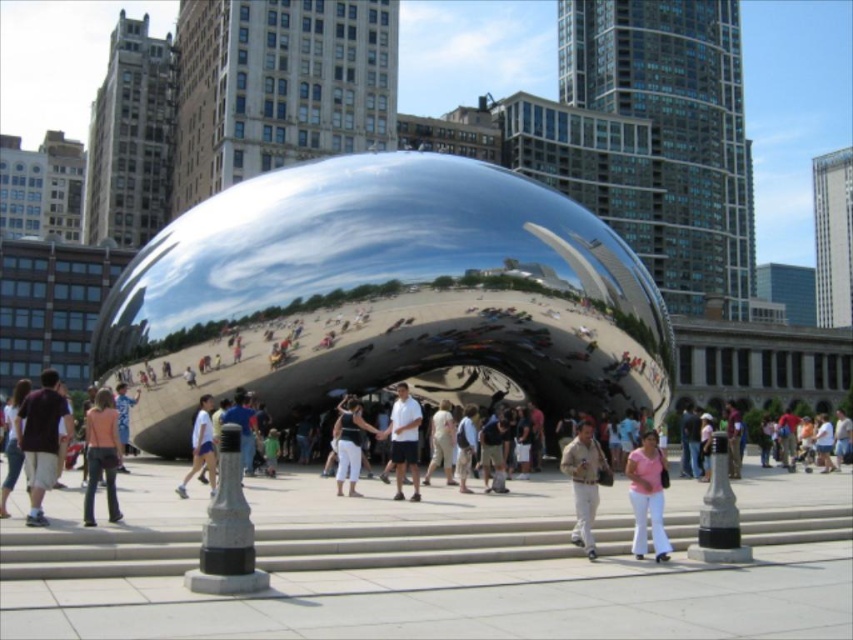
You are a photographer standing at the base of Cloud Gate in Chicago. You see a person wearing a white shirt at center and white cotton pants at center. If you want to take a photo of both items, will you need to adjust your camera focus to capture both clearly?

The white shirt at center and white cotton pants at center are 9.09 feet apart. Since they are more than a few feet apart, you may need to adjust your camera focus to ensure both are in clear view.

You are a photographer standing at the base of the Cloud Gate sculpture. You see a person wearing pink fabric pants at center and a person wearing white shirt at center. Which person is closer to you?

The pink fabric pants at center is in front of the white shirt at center, so the person wearing pink fabric pants at center is closer to you.